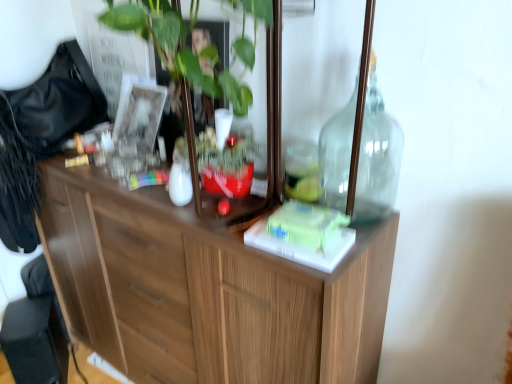
Describe the element at coordinates (206, 288) in the screenshot. The width and height of the screenshot is (512, 384). I see `wooden cabinet at center` at that location.

Locate an element on the screen. This screenshot has height=384, width=512. wooden cabinet at center is located at coordinates (206, 288).

From a real-world perspective, between wooden cabinet at center and transparent glass bottle at upper right, who is vertically higher?

wooden cabinet at center is physically above.

Does wooden cabinet at center have a greater height compared to transparent glass bottle at upper right?

Indeed, wooden cabinet at center has a greater height compared to transparent glass bottle at upper right.

Is the position of wooden cabinet at center more distant than that of transparent glass bottle at upper right?

No.

In the image, there is a wooden cabinet at center. In order to click on bottle below it (from the image's perspective) in this screenshot , I will do [377, 156].

In terms of size, does black plastic swivel chair at lower left appear bigger or smaller than transparent glass bottle at upper right?

In the image, black plastic swivel chair at lower left appears to be larger than transparent glass bottle at upper right.

Does point (37, 338) appear closer or farther from the camera than point (324, 140)?

Point (37, 338).

What's the angular difference between black plastic swivel chair at lower left and transparent glass bottle at upper right's facing directions?

They differ by 52.8 degrees in their facing directions.

Is black plastic swivel chair at lower left at the right side of transparent glass bottle at upper right?

No.

Can wooden cabinet at center be found inside black plastic swivel chair at lower left?

No, black plastic swivel chair at lower left does not contain wooden cabinet at center.

From the image's perspective, is black plastic swivel chair at lower left under wooden cabinet at center?

Correct, black plastic swivel chair at lower left appears lower than wooden cabinet at center in the image.

Is black plastic swivel chair at lower left oriented away from wooden cabinet at center?

No.

From a real-world perspective, between black plastic swivel chair at lower left and wooden cabinet at center, who is vertically lower?

black plastic swivel chair at lower left, from a real-world perspective.

From a real-world perspective, which is physically above, transparent glass bottle at upper right or black plastic swivel chair at lower left?

transparent glass bottle at upper right is physically above.

Considering the relative positions of transparent glass bottle at upper right and black plastic swivel chair at lower left in the image provided, is transparent glass bottle at upper right to the right of black plastic swivel chair at lower left from the viewer's perspective?

Yes, transparent glass bottle at upper right is to the right of black plastic swivel chair at lower left.

Is black plastic swivel chair at lower left surrounded by transparent glass bottle at upper right?

No, transparent glass bottle at upper right does not contain black plastic swivel chair at lower left.

What's the angular difference between transparent glass bottle at upper right and black plastic swivel chair at lower left's facing directions?

transparent glass bottle at upper right and black plastic swivel chair at lower left are facing 52.8 degrees away from each other.

Is transparent glass bottle at upper right turned away from wooden cabinet at center?

Absolutely, transparent glass bottle at upper right is directed away from wooden cabinet at center.

From the image's perspective, which is above, transparent glass bottle at upper right or wooden cabinet at center?

wooden cabinet at center, from the image's perspective.

Looking at this image, can you tell me how much transparent glass bottle at upper right and wooden cabinet at center differ in facing direction?

They differ by 1.51 degrees in their facing directions.

Looking at this image, considering the sizes of objects transparent glass bottle at upper right and wooden cabinet at center in the image provided, who is taller, transparent glass bottle at upper right or wooden cabinet at center?

With more height is wooden cabinet at center.

Does wooden cabinet at center touch black plastic swivel chair at lower left?

wooden cabinet at center and black plastic swivel chair at lower left are clearly separated.

Is wooden cabinet at center positioned with its back to black plastic swivel chair at lower left?

That's not correct — wooden cabinet at center is not looking away from black plastic swivel chair at lower left.

What are the coordinates of `bottle lying below the wooden cabinet at center (from the image's perspective)` in the screenshot? It's located at (377, 156).

What are the coordinates of `bottle that is above the black plastic swivel chair at lower left (from a real-world perspective)` in the screenshot? It's located at (377, 156).

Based on their spatial positions, is transparent glass bottle at upper right or black plastic swivel chair at lower left closer to wooden cabinet at center?

Among the two, transparent glass bottle at upper right is located nearer to wooden cabinet at center.

Based on their spatial positions, is wooden cabinet at center or black plastic swivel chair at lower left closer to transparent glass bottle at upper right?

Based on the image, wooden cabinet at center appears to be nearer to transparent glass bottle at upper right.

Looking at this image, considering their positions, is wooden cabinet at center positioned closer to black plastic swivel chair at lower left than transparent glass bottle at upper right?

wooden cabinet at center.

When comparing their distances from black plastic swivel chair at lower left, does transparent glass bottle at upper right or wooden cabinet at center seem closer?

Based on the image, wooden cabinet at center appears to be nearer to black plastic swivel chair at lower left.

Considering their positions, is black plastic swivel chair at lower left positioned closer to transparent glass bottle at upper right than wooden cabinet at center?

wooden cabinet at center is closer to transparent glass bottle at upper right.

Which object lies nearer to the anchor point wooden cabinet at center, black plastic swivel chair at lower left or transparent glass bottle at upper right?

transparent glass bottle at upper right is closer to wooden cabinet at center.

Find the location of `cabinetry located between black plastic swivel chair at lower left and transparent glass bottle at upper right in the left-right direction`. cabinetry located between black plastic swivel chair at lower left and transparent glass bottle at upper right in the left-right direction is located at coordinates (206, 288).